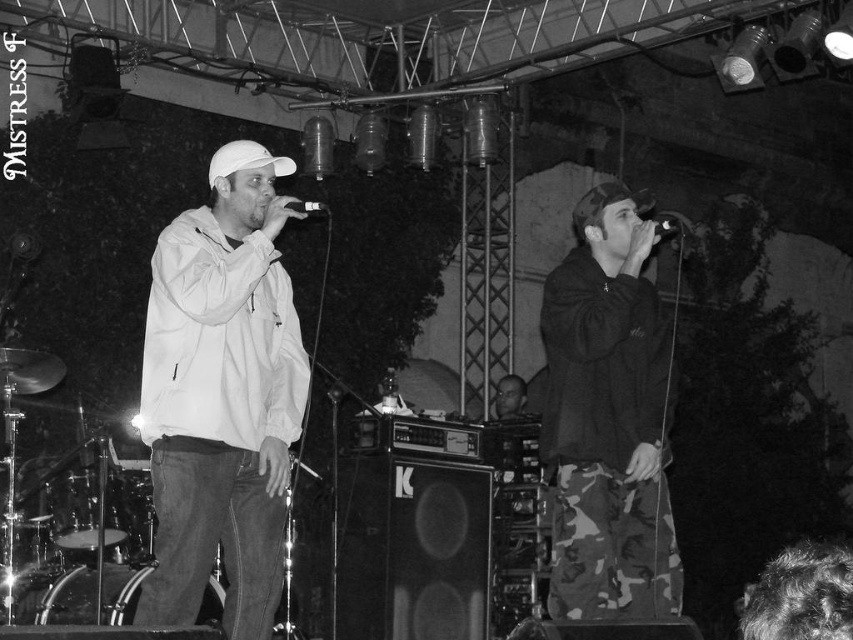
Which of these two, camo pants at right or smooth skin head at center, stands shorter?

smooth skin head at center

Between point (575, 308) and point (508, 401), which one is positioned behind?

The point (508, 401) is behind.

The width and height of the screenshot is (853, 640). Find the location of `camo pants at right`. camo pants at right is located at coordinates (608, 419).

Can you confirm if white matte jacket at left is positioned below smooth skin head at center?

No.

Does point (299, 428) lie behind point (515, 416)?

No, (299, 428) is in front of (515, 416).

This screenshot has width=853, height=640. I want to click on white matte jacket at left, so click(x=221, y=396).

Can you confirm if white matte jacket at left is smaller than metallic silver microphone at center?

Yes.

Find the location of a particular element. The height and width of the screenshot is (640, 853). white matte jacket at left is located at coordinates (221, 396).